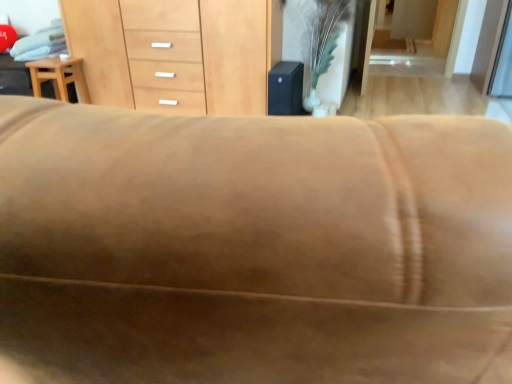
Question: Can you confirm if green leafy plant at center is shorter than light brown wood stool at left?

Choices:
 (A) no
 (B) yes

Answer: (A)

Question: Is green leafy plant at center positioned beyond the bounds of light brown wood stool at left?

Choices:
 (A) no
 (B) yes

Answer: (B)

Question: Can you confirm if green leafy plant at center is taller than light brown wood stool at left?

Choices:
 (A) no
 (B) yes

Answer: (B)

Question: Does green leafy plant at center appear on the right side of light brown wood stool at left?

Choices:
 (A) yes
 (B) no

Answer: (A)

Question: Does green leafy plant at center touch light brown wood stool at left?

Choices:
 (A) no
 (B) yes

Answer: (A)

Question: From a real-world perspective, relative to light brown wood stool at left, is light brown wood chest of drawers at center vertically above or below?

Choices:
 (A) below
 (B) above

Answer: (B)

Question: Based on their positions, is light brown wood chest of drawers at center located to the left or right of light brown wood stool at left?

Choices:
 (A) right
 (B) left

Answer: (A)

Question: From their relative heights in the image, would you say light brown wood chest of drawers at center is taller or shorter than light brown wood stool at left?

Choices:
 (A) tall
 (B) short

Answer: (A)

Question: From the image's perspective, is light brown wood chest of drawers at center located above or below light brown wood stool at left?

Choices:
 (A) above
 (B) below

Answer: (A)

Question: Is light brown wood stool at left bigger or smaller than light brown wood chest of drawers at center?

Choices:
 (A) small
 (B) big

Answer: (A)

Question: From the image's perspective, relative to light brown wood chest of drawers at center, is light brown wood stool at left above or below?

Choices:
 (A) above
 (B) below

Answer: (B)

Question: Is light brown wood stool at left spatially inside light brown wood chest of drawers at center, or outside of it?

Choices:
 (A) outside
 (B) inside

Answer: (A)

Question: Considering the positions of point (30, 61) and point (91, 91), is point (30, 61) closer or farther from the camera than point (91, 91)?

Choices:
 (A) closer
 (B) farther

Answer: (A)

Question: Relative to green leafy plant at center, is light brown wood stool at left in front or behind?

Choices:
 (A) front
 (B) behind

Answer: (B)

Question: Looking at their shapes, would you say light brown wood stool at left is wider or thinner than green leafy plant at center?

Choices:
 (A) thin
 (B) wide

Answer: (A)